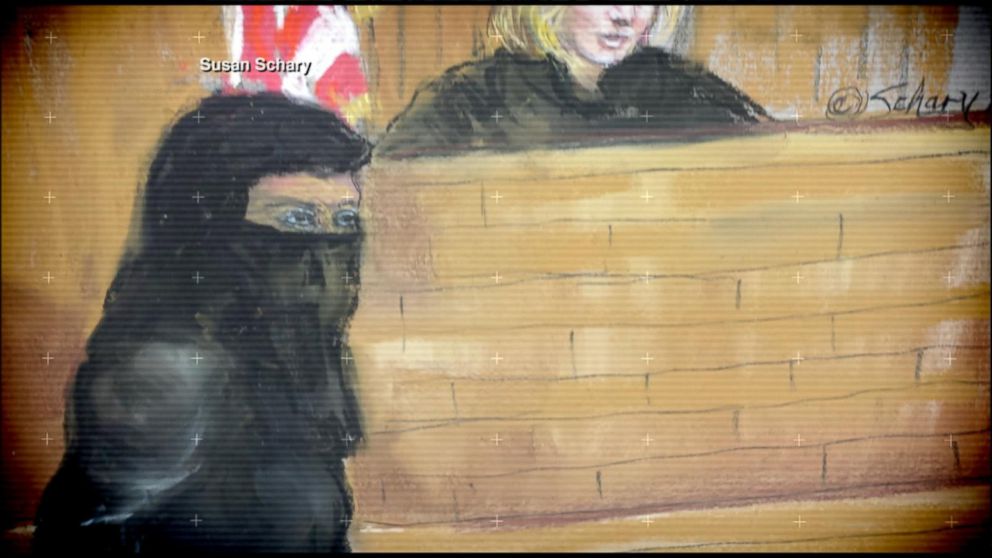
Where is `wall`? wall is located at coordinates (85, 202).